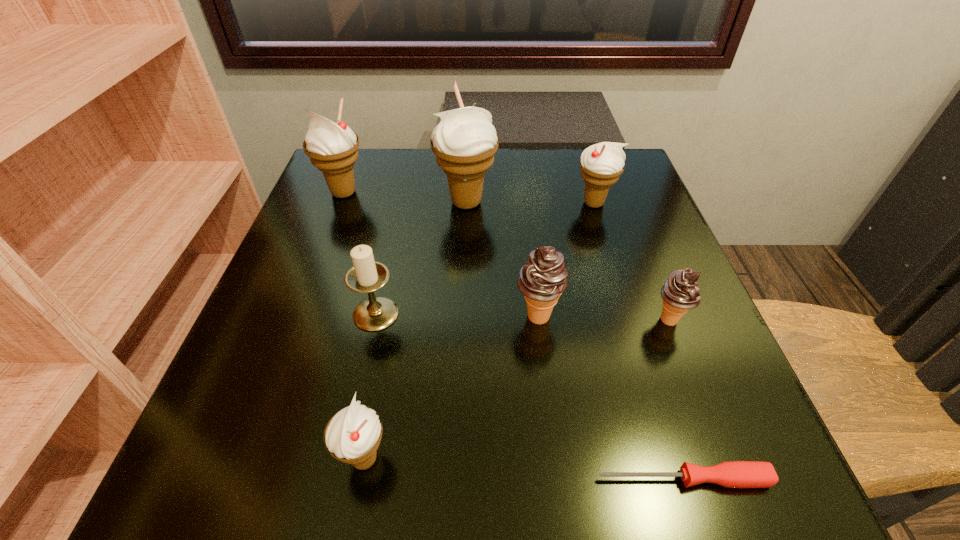
Point out which icecream is positioned as the fifth nearest to the nearest icecream. Please provide its 2D coordinates. Your answer should be formatted as a tuple, i.e. [(x, y)], where the tuple contains the x and y coordinates of a point satisfying the conditions above.

[(601, 164)]

Point out which white icecream is positioned as the third nearest to the left chocolate icecream. Please provide its 2D coordinates. Your answer should be formatted as a tuple, i.e. [(x, y)], where the tuple contains the x and y coordinates of a point satisfying the conditions above.

[(601, 164)]

The width and height of the screenshot is (960, 540). I want to click on white icecream that stands as the closest to the fifth object from right to left, so click(332, 147).

I want to click on vacant region that satisfies the following two spatial constraints: 1. on the back side of the tallest icecream; 2. on the right side of the white candle holder, so click(x=400, y=202).

What are the coordinates of `free location that satisfies the following two spatial constraints: 1. on the back side of the rightmost white icecream; 2. on the left side of the bigger chocolate icecream` in the screenshot? It's located at 524,203.